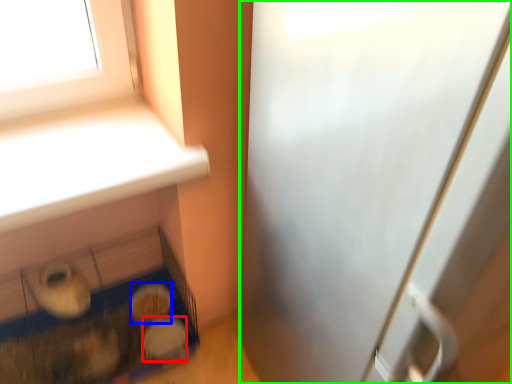
Question: Based on their relative distances, which object is nearer to food (highlighted by a red box)? Choose from food (highlighted by a blue box) and screen door (highlighted by a green box).

Choices:
 (A) food
 (B) screen door

Answer: (A)